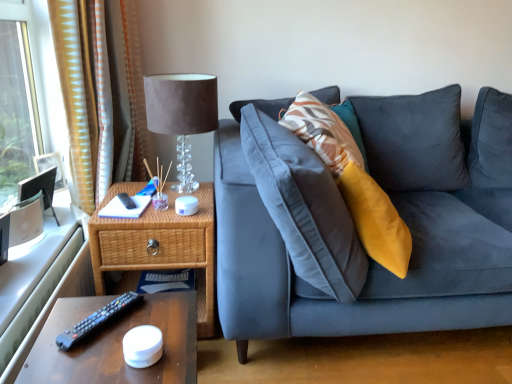
Question: Is brown wooden table at lower left surrounded by black plastic remote at lower left?

Choices:
 (A) yes
 (B) no

Answer: (B)

Question: Does black plastic remote at lower left have a larger size compared to brown wooden table at lower left?

Choices:
 (A) yes
 (B) no

Answer: (B)

Question: Would you consider black plastic remote at lower left to be distant from brown wooden table at lower left?

Choices:
 (A) yes
 (B) no

Answer: (B)

Question: Considering the relative sizes of black plastic remote at lower left and brown wooden table at lower left in the image provided, is black plastic remote at lower left taller than brown wooden table at lower left?

Choices:
 (A) yes
 (B) no

Answer: (B)

Question: Is black plastic remote at lower left further to camera compared to brown wooden table at lower left?

Choices:
 (A) no
 (B) yes

Answer: (B)

Question: Is black plastic remote at lower left in contact with brown wooden table at lower left?

Choices:
 (A) no
 (B) yes

Answer: (B)

Question: Can we say yellow striped fabric at left lies outside suede-like fabric lampshade at upper left?

Choices:
 (A) yes
 (B) no

Answer: (A)

Question: Can you confirm if yellow striped fabric at left is positioned to the right of suede-like fabric lampshade at upper left?

Choices:
 (A) yes
 (B) no

Answer: (B)

Question: From the image's perspective, does yellow striped fabric at left appear lower than suede-like fabric lampshade at upper left?

Choices:
 (A) no
 (B) yes

Answer: (A)

Question: Does yellow striped fabric at left have a smaller size compared to suede-like fabric lampshade at upper left?

Choices:
 (A) no
 (B) yes

Answer: (A)

Question: From a real-world perspective, is yellow striped fabric at left over suede-like fabric lampshade at upper left?

Choices:
 (A) yes
 (B) no

Answer: (A)

Question: Is yellow striped fabric at left placed right next to suede-like fabric lampshade at upper left?

Choices:
 (A) yes
 (B) no

Answer: (B)

Question: Are suede-like fabric lampshade at upper left and yellow striped fabric at left located far from each other?

Choices:
 (A) yes
 (B) no

Answer: (B)